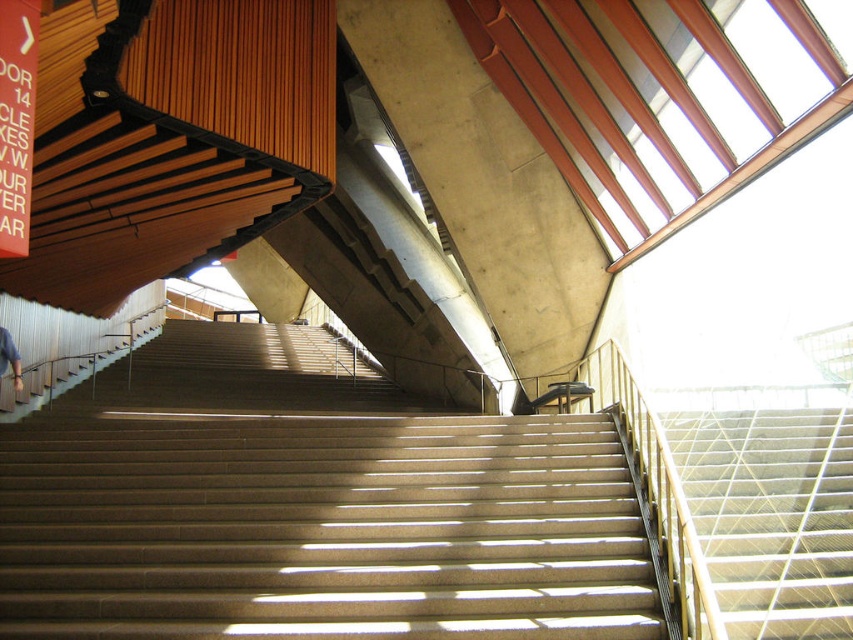
Question: Can you confirm if brown concrete stairs at center is positioned to the right of metallic silver stairs at center?

Choices:
 (A) yes
 (B) no

Answer: (B)

Question: Can you confirm if metallic silver stairs at center is positioned above blue denim jeans at lower left?

Choices:
 (A) yes
 (B) no

Answer: (B)

Question: Considering the real-world distances, which object is closest to the blue denim jeans at lower left?

Choices:
 (A) brown concrete stairs at center
 (B) metallic silver stairs at center

Answer: (A)

Question: Which point is closer to the camera?

Choices:
 (A) (15, 372)
 (B) (160, 454)
 (C) (814, 410)

Answer: (C)

Question: Is brown concrete stairs at center to the right of blue denim jeans at lower left from the viewer's perspective?

Choices:
 (A) yes
 (B) no

Answer: (A)

Question: Which point is closer to the camera taking this photo?

Choices:
 (A) (850, 572)
 (B) (3, 332)

Answer: (A)